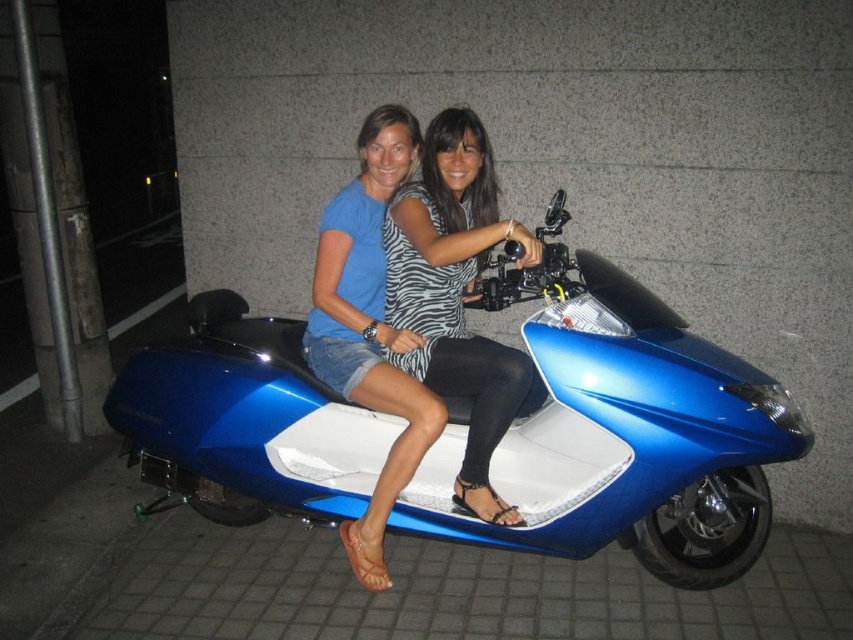
Question: Which of these objects is positioned farthest from the blue metallic scooter at center?

Choices:
 (A) zebra print dress at center
 (B) blue denim shorts at center
 (C) striped fabric dress at center

Answer: (C)

Question: Is blue metallic scooter at center below zebra print dress at center?

Choices:
 (A) yes
 (B) no

Answer: (A)

Question: Estimate the real-world distances between objects in this image. Which object is farther from the blue denim shorts at center?

Choices:
 (A) striped fabric dress at center
 (B) zebra print dress at center
 (C) blue metallic scooter at center

Answer: (C)

Question: Considering the real-world distances, which object is farthest from the zebra print dress at center?

Choices:
 (A) blue metallic scooter at center
 (B) blue denim shorts at center

Answer: (A)

Question: Is blue metallic scooter at center bigger than blue denim shorts at center?

Choices:
 (A) no
 (B) yes

Answer: (B)

Question: Can you confirm if zebra print dress at center is thinner than striped fabric dress at center?

Choices:
 (A) no
 (B) yes

Answer: (A)